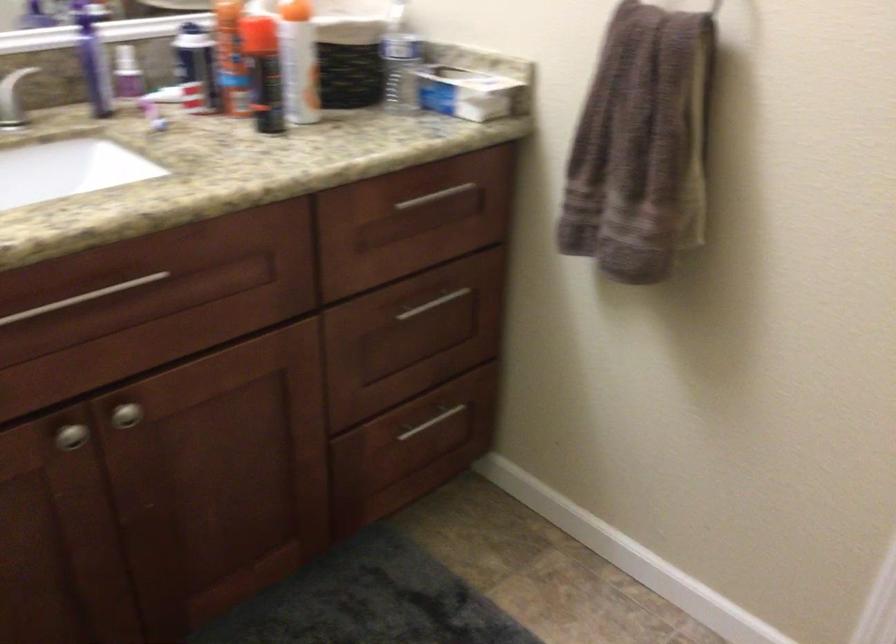
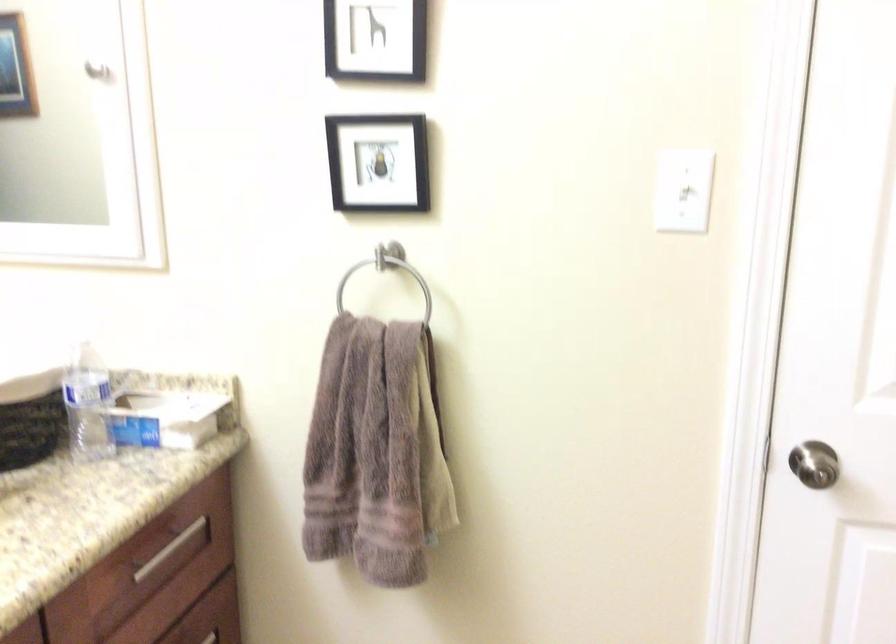
Where in the second image is the point corresponding to [455,88] from the first image?

(165, 418)